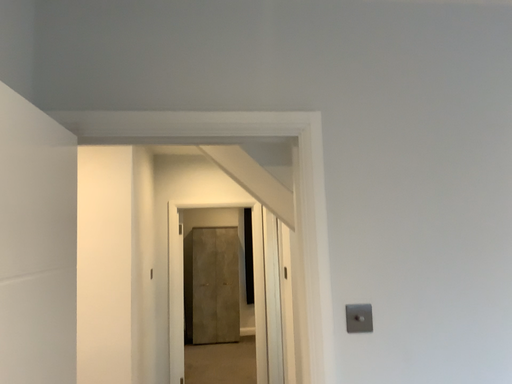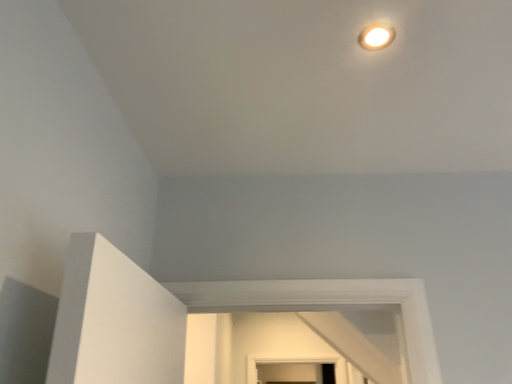
Question: How did the camera likely rotate when shooting the video?

Choices:
 (A) rotated right
 (B) rotated left

Answer: (B)